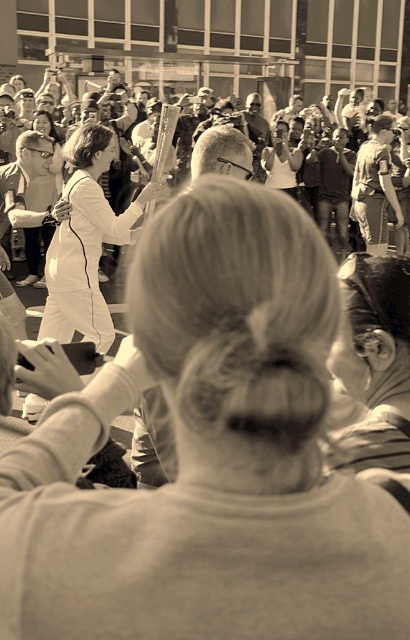
You are a photographer at the event and need to focus your lens on the central figure. Since the white smooth dress at center and the metallic torch at center are both in the frame, which object should you adjust your focus to ensure the dress is clearer than the torch?

The white smooth dress at center is thinner than the metallic torch at center, so you should focus on the dress as it requires a higher resolution to capture its details properly.